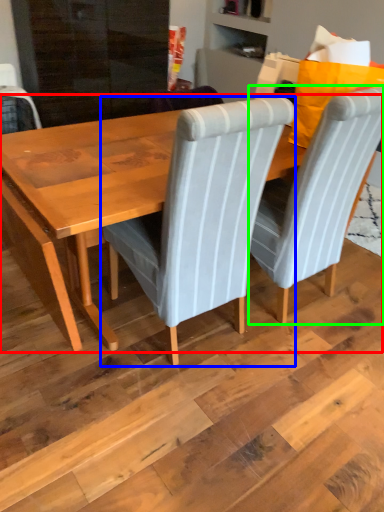
Question: Considering the real-world distances, which object is closest to table (highlighted by a red box)? chair (highlighted by a blue box) or chair (highlighted by a green box).

Choices:
 (A) chair
 (B) chair

Answer: (A)